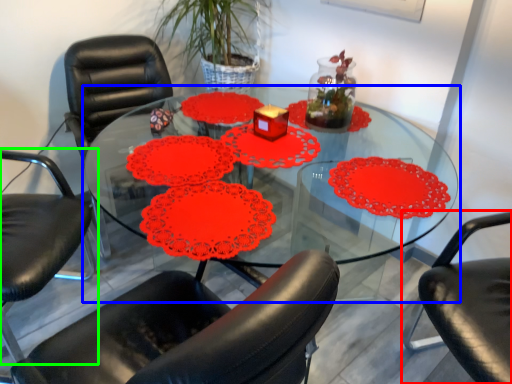
Question: Which is farther away from chair (highlighted by a red box)? table (highlighted by a blue box) or chair (highlighted by a green box)?

Choices:
 (A) table
 (B) chair

Answer: (B)